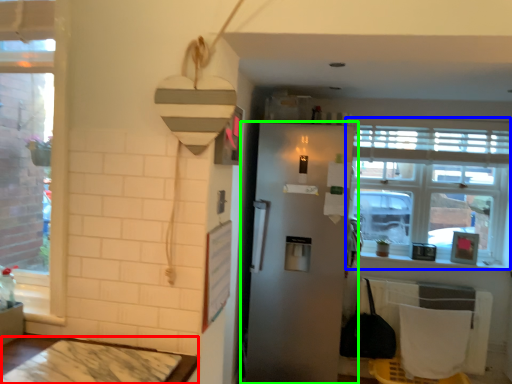
Question: Considering the real-world distances, which object is closest to table (highlighted by a red box)? window (highlighted by a blue box) or refrigerator (highlighted by a green box).

Choices:
 (A) window
 (B) refrigerator

Answer: (B)